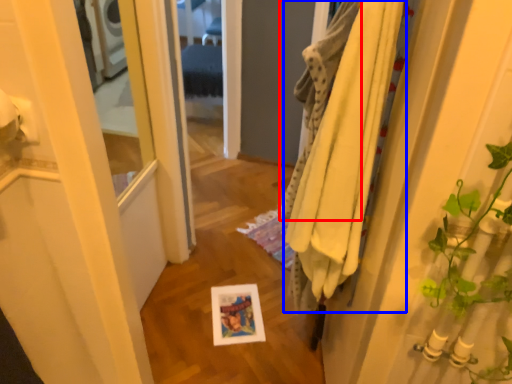
Question: Which point is further to the camera, bath towel (highlighted by a red box) or bath towel (highlighted by a blue box)?

Choices:
 (A) bath towel
 (B) bath towel

Answer: (A)